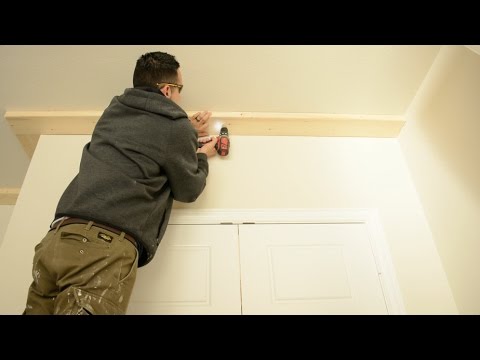
Where is `door`? The width and height of the screenshot is (480, 360). door is located at coordinates (242, 229).